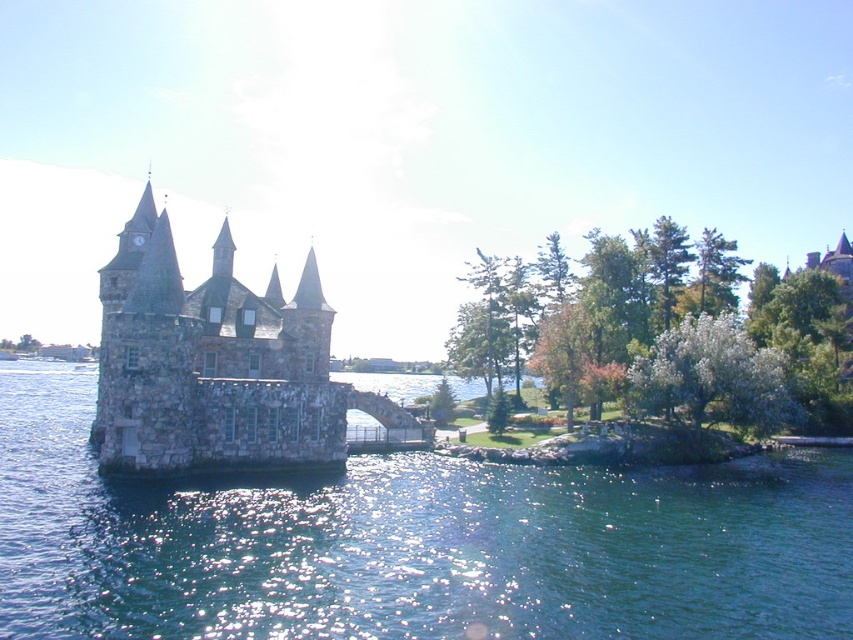
Question: Which point is closer to the camera?

Choices:
 (A) clear blue water at center
 (B) stone castle at center

Answer: (A)

Question: Does clear blue water at center have a greater width compared to stone castle at center?

Choices:
 (A) no
 (B) yes

Answer: (B)

Question: Does clear blue water at center appear on the left side of stone castle at center?

Choices:
 (A) no
 (B) yes

Answer: (A)

Question: Does clear blue water at center have a lesser width compared to stone castle at center?

Choices:
 (A) yes
 (B) no

Answer: (B)